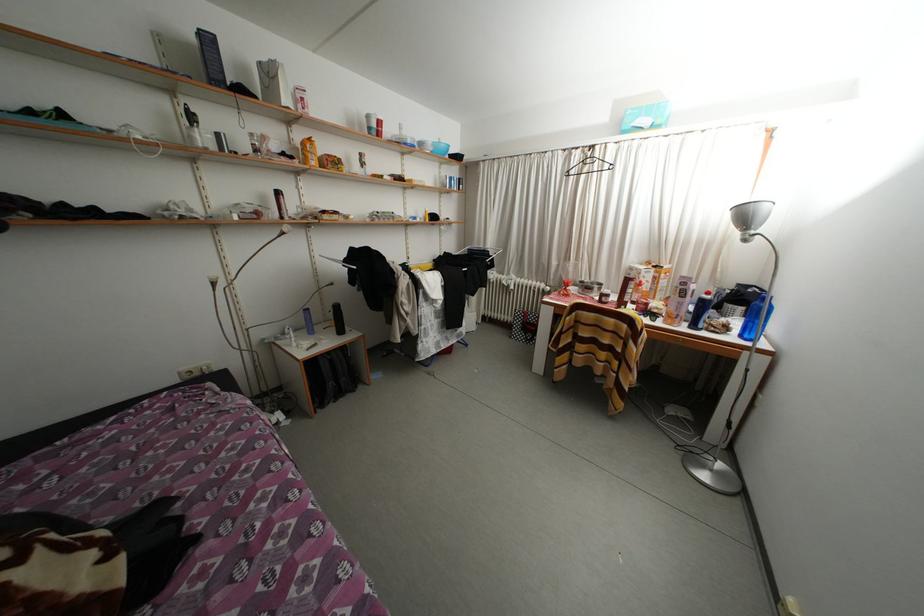
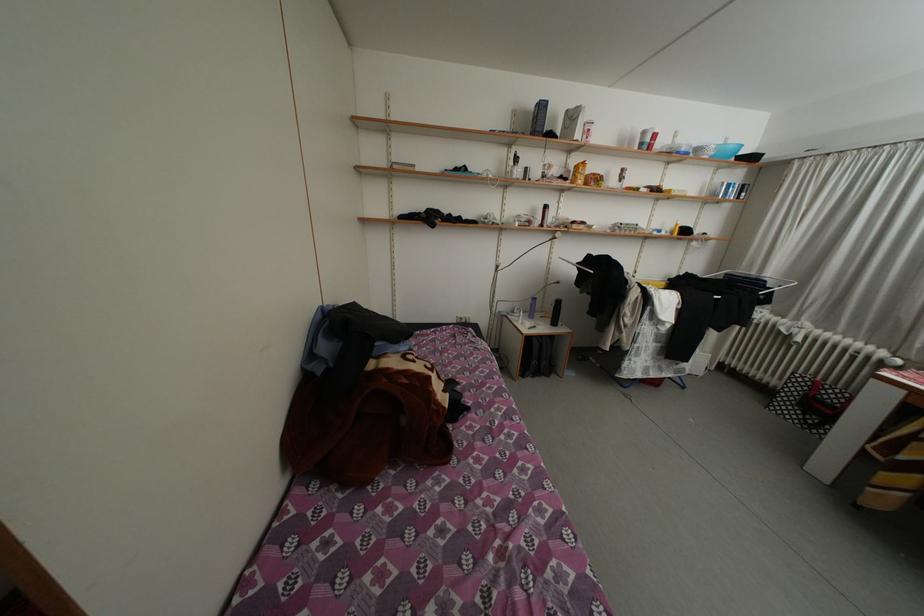
Where in the second image is the point corresponding to (x=359, y=254) from the first image?

(597, 262)